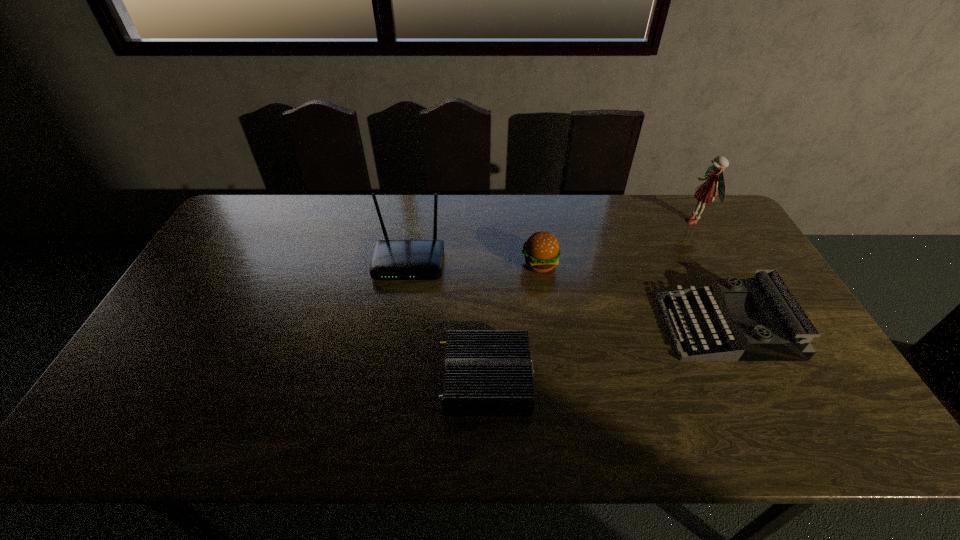
I want to click on vacant space positioned 0.250m on the front-facing side of the farthest object, so click(612, 221).

The width and height of the screenshot is (960, 540). What are the coordinates of `vacant space situated 0.100m on the front-facing side of the left router` in the screenshot? It's located at (402, 308).

Locate an element on the screen. This screenshot has height=540, width=960. vacant space positioned on the left of the hamburger is located at coordinates (409, 264).

You are a GUI agent. You are given a task and a screenshot of the screen. Output one action in this format:
    pyautogui.click(x=<x>, y=<y>)
    Task: Click on the vacant space located 0.380m on the typing side of the typewriter
    The image size is (960, 540).
    Given the screenshot: What is the action you would take?
    pyautogui.click(x=529, y=327)

Locate an element on the screen. free space located on the typing side of the typewriter is located at coordinates (569, 327).

This screenshot has height=540, width=960. What are the coordinates of `free spot located on the typing side of the typewriter` in the screenshot? It's located at (572, 327).

This screenshot has width=960, height=540. I want to click on vacant space located on the back panel of the right router, so click(372, 380).

Image resolution: width=960 pixels, height=540 pixels. In order to click on vacant space situated on the back panel of the right router in this screenshot , I will do `click(379, 380)`.

You are a GUI agent. You are given a task and a screenshot of the screen. Output one action in this format:
    pyautogui.click(x=<x>, y=<y>)
    Task: Click on the vacant space situated 0.180m on the back panel of the right router
    
    Given the screenshot: What is the action you would take?
    pyautogui.click(x=367, y=380)

The height and width of the screenshot is (540, 960). I want to click on object that is at the far edge, so click(705, 193).